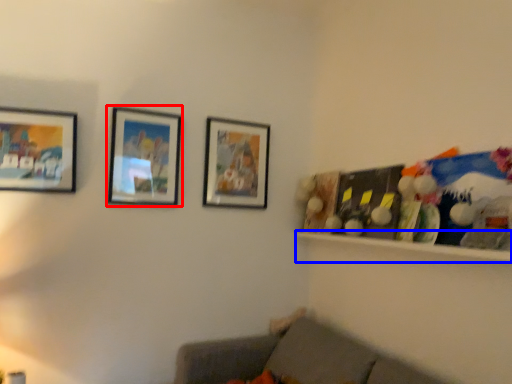
Question: Among these objects, which one is farthest to the camera, picture frame (highlighted by a red box) or shelf (highlighted by a blue box)?

Choices:
 (A) picture frame
 (B) shelf

Answer: (A)